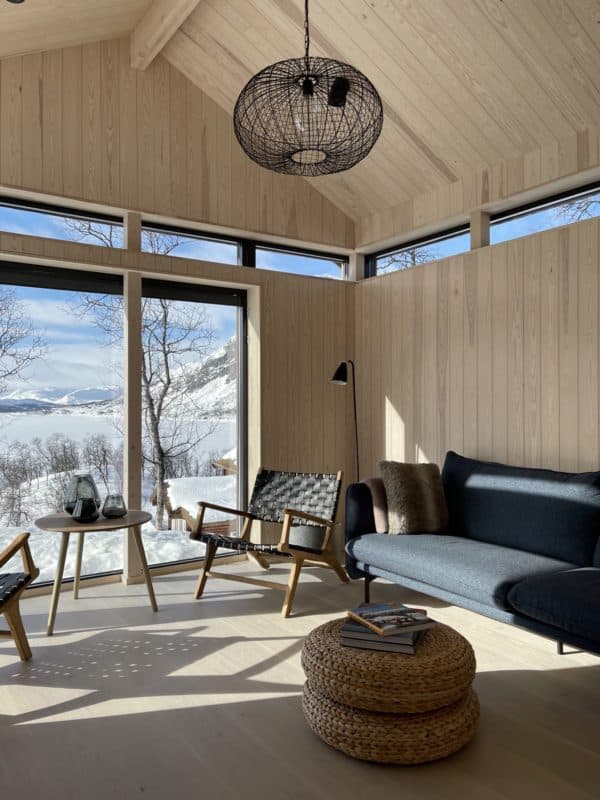
Where is `light`? The width and height of the screenshot is (600, 800). light is located at coordinates (355, 414).